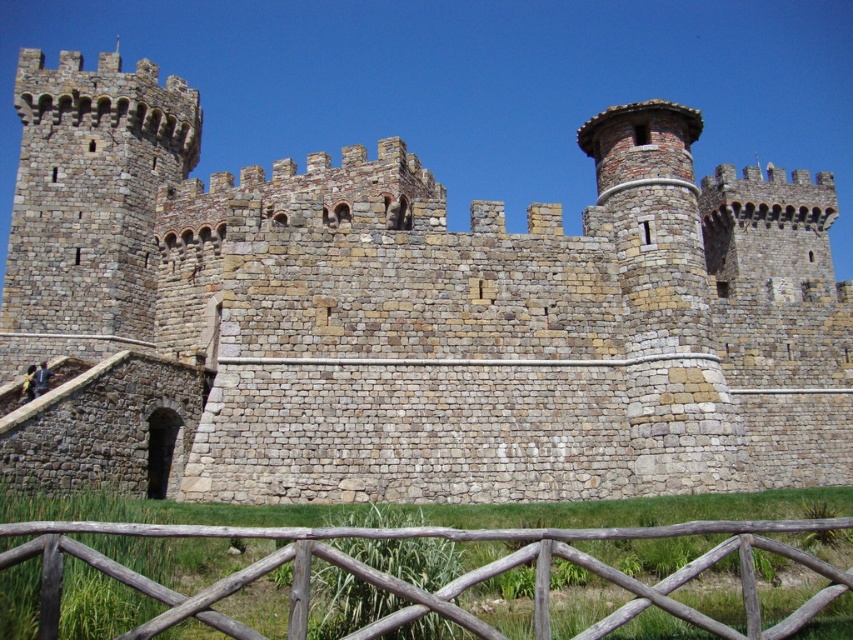
Question: In this image, where is brown stone castle at center located relative to wooden fence at lower center?

Choices:
 (A) left
 (B) right

Answer: (B)

Question: Can you confirm if brown stone castle at center is positioned below wooden fence at lower center?

Choices:
 (A) yes
 (B) no

Answer: (B)

Question: Is brown stone castle at center to the left of wooden fence at lower center from the viewer's perspective?

Choices:
 (A) no
 (B) yes

Answer: (A)

Question: Which object is closer to the camera taking this photo?

Choices:
 (A) brown stone castle at center
 (B) wooden fence at lower center

Answer: (B)